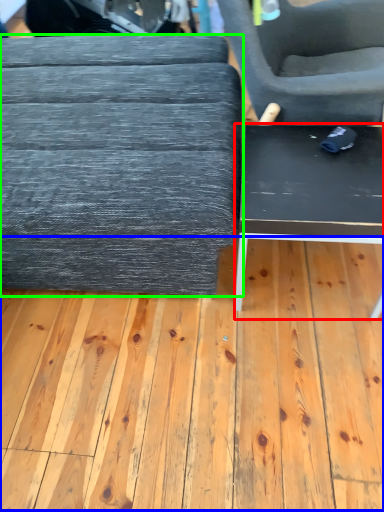
Question: Which is farther away from table (highlighted by a red box)? plywood (highlighted by a blue box) or table (highlighted by a green box)?

Choices:
 (A) plywood
 (B) table

Answer: (A)